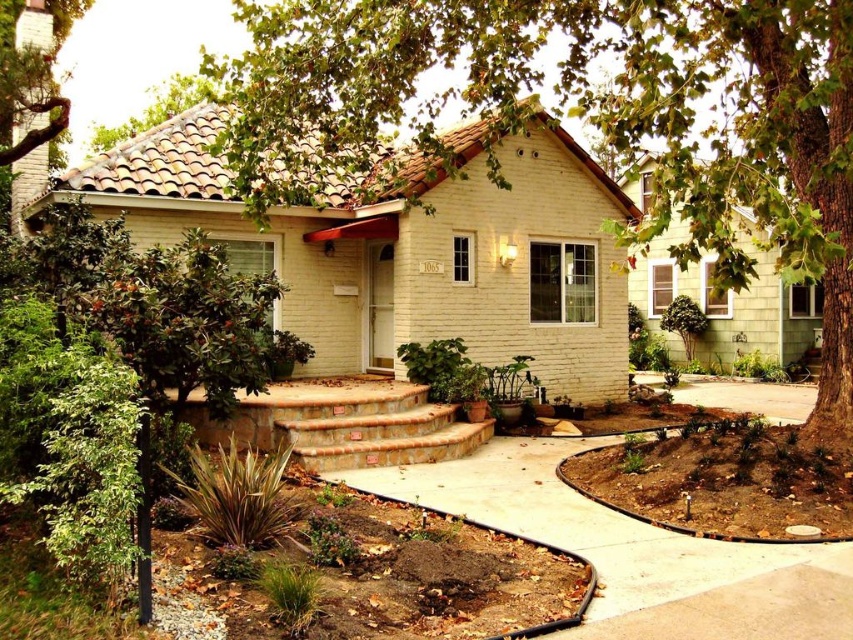
Question: Among these points, which one is farthest from the camera?

Choices:
 (A) (360, 97)
 (B) (317, 451)
 (C) (606, 582)

Answer: (A)

Question: Which of the following is the closest to the observer?

Choices:
 (A) brown concrete path at lower center
 (B) green leafy tree at center

Answer: (A)

Question: Is green leafy tree at center further to the viewer compared to brown concrete path at lower center?

Choices:
 (A) yes
 (B) no

Answer: (A)

Question: Which object is the closest to the brown concrete path at lower center?

Choices:
 (A) green leafy tree at center
 (B) green leafy tree at upper left

Answer: (A)

Question: Is terracotta brick stairs at center positioned in front of green leafy tree at upper left?

Choices:
 (A) no
 (B) yes

Answer: (B)

Question: Is terracotta brick stairs at center above green leafy tree at upper left?

Choices:
 (A) no
 (B) yes

Answer: (A)